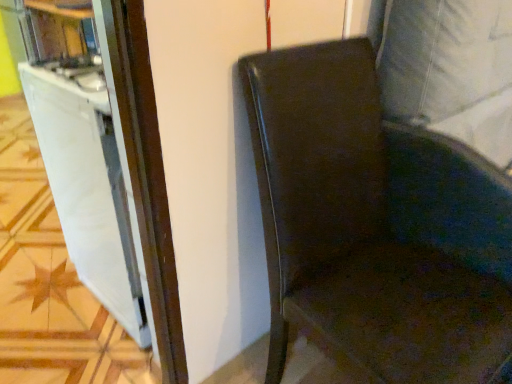
Question: From the image's perspective, relative to glossy leather chair at right, is white glossy file cabinet at left above or below?

Choices:
 (A) below
 (B) above

Answer: (B)

Question: Considering the positions of white glossy file cabinet at left and glossy leather chair at right in the image, is white glossy file cabinet at left taller or shorter than glossy leather chair at right?

Choices:
 (A) tall
 (B) short

Answer: (B)

Question: Relative to glossy leather chair at right, is white glossy file cabinet at left in front or behind?

Choices:
 (A) behind
 (B) front

Answer: (A)

Question: From a real-world perspective, relative to white glossy file cabinet at left, is glossy leather chair at right vertically above or below?

Choices:
 (A) above
 (B) below

Answer: (A)

Question: Based on their sizes in the image, would you say glossy leather chair at right is bigger or smaller than white glossy file cabinet at left?

Choices:
 (A) small
 (B) big

Answer: (B)

Question: From their relative heights in the image, would you say glossy leather chair at right is taller or shorter than white glossy file cabinet at left?

Choices:
 (A) short
 (B) tall

Answer: (B)

Question: Is glossy leather chair at right to the left or to the right of white glossy file cabinet at left in the image?

Choices:
 (A) left
 (B) right

Answer: (B)